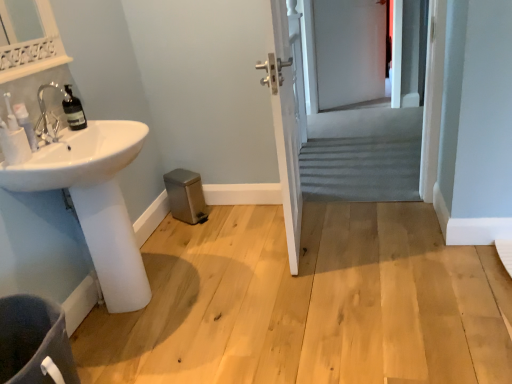
Locate an element on the screen. vacant space in front of white wooden door at center is located at coordinates [316, 283].